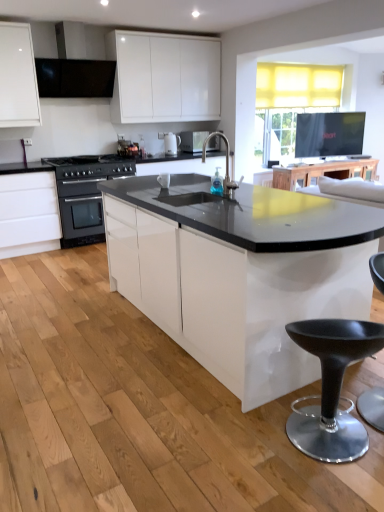
Question: Is black plastic stool at lower right not near black stainless steel oven at left?

Choices:
 (A) yes
 (B) no

Answer: (A)

Question: Is black plastic stool at lower right closer to camera compared to black stainless steel oven at left?

Choices:
 (A) yes
 (B) no

Answer: (A)

Question: From a real-world perspective, is black plastic stool at lower right physically below black stainless steel oven at left?

Choices:
 (A) no
 (B) yes

Answer: (B)

Question: Is black plastic stool at lower right at the left side of black stainless steel oven at left?

Choices:
 (A) yes
 (B) no

Answer: (B)

Question: Does black plastic stool at lower right have a lesser height compared to black stainless steel oven at left?

Choices:
 (A) no
 (B) yes

Answer: (B)

Question: From the image's perspective, relative to wooden table at upper center, is white glossy coffee machine at center above or below?

Choices:
 (A) below
 (B) above

Answer: (B)

Question: Looking at their shapes, would you say white glossy coffee machine at center is wider or thinner than wooden table at upper center?

Choices:
 (A) thin
 (B) wide

Answer: (A)

Question: Considering their positions, is white glossy coffee machine at center located in front of or behind wooden table at upper center?

Choices:
 (A) front
 (B) behind

Answer: (A)

Question: Is white glossy coffee machine at center inside the boundaries of wooden table at upper center, or outside?

Choices:
 (A) inside
 (B) outside

Answer: (B)

Question: Which is correct: white glossy cabinet at left is inside black plastic swivel chair at lower right, or outside of it?

Choices:
 (A) outside
 (B) inside

Answer: (A)

Question: Would you say white glossy cabinet at left is to the left or to the right of black plastic swivel chair at lower right in the picture?

Choices:
 (A) left
 (B) right

Answer: (A)

Question: In terms of height, does white glossy cabinet at left look taller or shorter compared to black plastic swivel chair at lower right?

Choices:
 (A) tall
 (B) short

Answer: (A)

Question: Does point coord(39,203) appear closer or farther from the camera than point coord(367,413)?

Choices:
 (A) closer
 (B) farther

Answer: (B)

Question: Considering the positions of black plastic swivel chair at lower right and black matte exhaust hood at upper left in the image, is black plastic swivel chair at lower right bigger or smaller than black matte exhaust hood at upper left?

Choices:
 (A) big
 (B) small

Answer: (B)

Question: In the image, is black plastic swivel chair at lower right on the left side or the right side of black matte exhaust hood at upper left?

Choices:
 (A) left
 (B) right

Answer: (B)